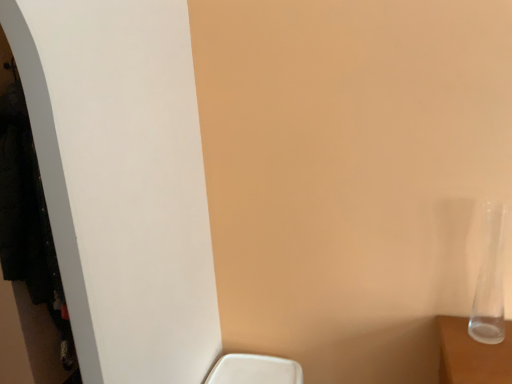
Question: Should I look upward or downward to see white matte closet at left?

Choices:
 (A) down
 (B) up

Answer: (A)

Question: From the image's perspective, is transparent glass vase at right under white matte closet at left?

Choices:
 (A) no
 (B) yes

Answer: (A)

Question: Is transparent glass vase at right with white matte closet at left?

Choices:
 (A) yes
 (B) no

Answer: (B)

Question: Does transparent glass vase at right contain white matte closet at left?

Choices:
 (A) no
 (B) yes

Answer: (A)

Question: Considering the relative sizes of transparent glass vase at right and white matte closet at left in the image provided, is transparent glass vase at right taller than white matte closet at left?

Choices:
 (A) no
 (B) yes

Answer: (A)

Question: From a real-world perspective, does transparent glass vase at right sit lower than white matte closet at left?

Choices:
 (A) yes
 (B) no

Answer: (B)

Question: Is transparent glass vase at right to the right of white matte closet at left from the viewer's perspective?

Choices:
 (A) yes
 (B) no

Answer: (A)

Question: Is white matte closet at left smaller than transparent glass vase at right?

Choices:
 (A) yes
 (B) no

Answer: (B)

Question: Is white matte closet at left not close to transparent glass vase at right?

Choices:
 (A) no
 (B) yes

Answer: (B)

Question: Considering the relative sizes of white matte closet at left and transparent glass vase at right in the image provided, is white matte closet at left taller than transparent glass vase at right?

Choices:
 (A) yes
 (B) no

Answer: (A)

Question: From a real-world perspective, does white matte closet at left sit lower than transparent glass vase at right?

Choices:
 (A) yes
 (B) no

Answer: (A)

Question: Does white matte closet at left have a lesser width compared to transparent glass vase at right?

Choices:
 (A) yes
 (B) no

Answer: (B)

Question: From the image's perspective, is white matte closet at left over transparent glass vase at right?

Choices:
 (A) yes
 (B) no

Answer: (B)

Question: From the image's perspective, relative to transparent glass vase at right, is white matte closet at left above or below?

Choices:
 (A) above
 (B) below

Answer: (B)